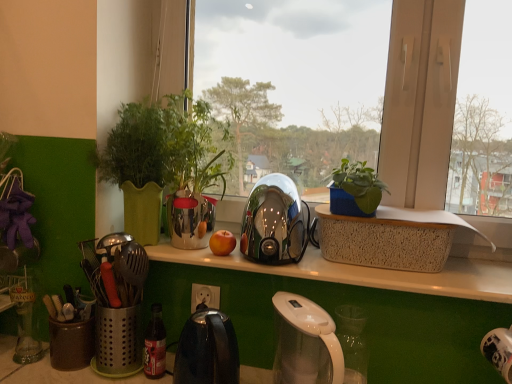
Find the location of a particular element. This screenshot has height=384, width=512. vacant space to the left of red matte apple at center is located at coordinates (179, 253).